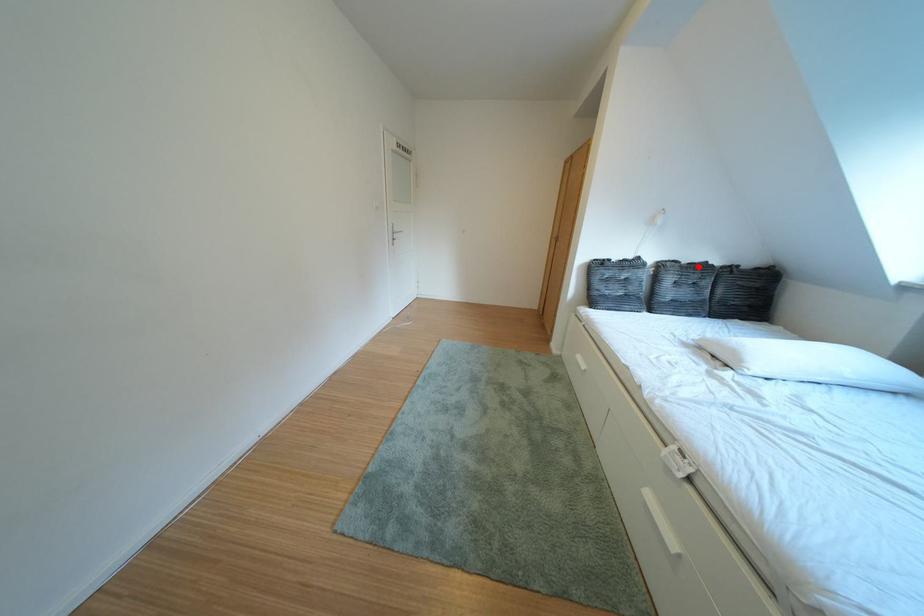
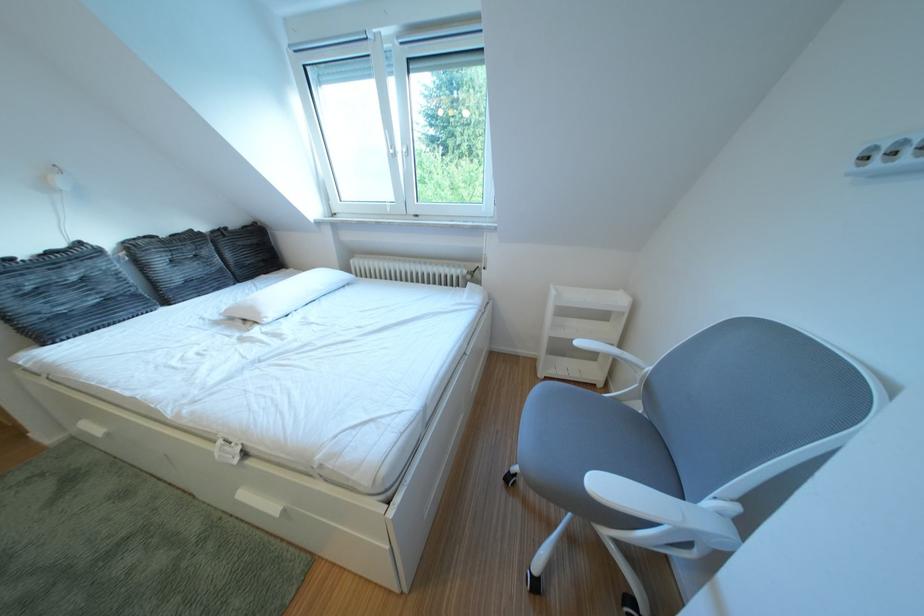
Locate, in the second image, the point that corresponds to the highlighted location in the first image.

(176, 240)